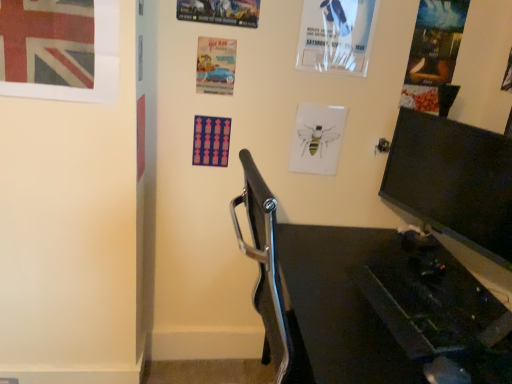
What do you see at coordinates (337, 35) in the screenshot?
I see `white paper poster at upper center, acting as the second poster page starting from the right` at bounding box center [337, 35].

Locate an element on the screen. union jack flag at upper left is located at coordinates (47, 42).

At what (x,y) coordinates should I click in order to perform the action: click on black plastic desk at lower right. Please return your answer as a coordinate pair (x, y). This screenshot has height=384, width=512. Looking at the image, I should click on (366, 301).

Locate an element on the screen. This screenshot has width=512, height=384. blue glossy car at center, marked as the second poster page in a left-to-right arrangement is located at coordinates (215, 65).

Where is `matte paper poster at upper right, which is counted as the first poster page, starting from the right`? The image size is (512, 384). matte paper poster at upper right, which is counted as the first poster page, starting from the right is located at coordinates (433, 52).

Locate an element on the screen. black glossy monitor at right is located at coordinates (453, 181).

Is the surface of black plastic desk at lower right in direct contact with blue glossy car at center, the fifth poster page in the right-to-left sequence?

They are not placed beside each other.

Consider the image. Is black plastic desk at lower right positioned with its back to blue glossy car at center, the fifth poster page in the right-to-left sequence?

That's not correct — black plastic desk at lower right is not looking away from blue glossy car at center, the fifth poster page in the right-to-left sequence.

Between point (339, 375) and point (212, 81), which one is positioned in front?

The point (339, 375) is more forward.

Considering the points (347, 259) and (193, 163), which point is behind, point (347, 259) or point (193, 163)?

The point (193, 163) is farther.

Considering the sizes of objects black plastic desk at lower right and matte plastic poster at center, the 6th poster page positioned from the right, in the image provided, who is shorter, black plastic desk at lower right or matte plastic poster at center, the 6th poster page positioned from the right,?

Standing shorter between the two is matte plastic poster at center, the 6th poster page positioned from the right.

Is black plastic desk at lower right in front of matte plastic poster at center, the 6th poster page positioned from the right?

Yes, it is.

Is black plastic desk at lower right situated inside matte plastic poster at center, the 6th poster page positioned from the right, or outside?

The correct answer is: outside.

Considering the sizes of objects white paper poster at upper center, acting as the second poster page starting from the right, and watercolor bee at center, the 3th poster page in the right-to-left sequence, in the image provided, who is thinner, white paper poster at upper center, acting as the second poster page starting from the right, or watercolor bee at center, the 3th poster page in the right-to-left sequence,?

watercolor bee at center, the 3th poster page in the right-to-left sequence, is thinner.

Does white paper poster at upper center, acting as the second poster page starting from the right, have a smaller size compared to watercolor bee at center, the 3th poster page in the right-to-left sequence?

No.

From a real-world perspective, starting from the white paper poster at upper center, acting as the second poster page starting from the right, which poster page is the 3rd one below it? Please provide its 2D coordinates.

[(317, 138)]

Is metallic silver car at upper center, the 3th poster page when ordered from left to right, positioned far away from blue glossy car at center, marked as the second poster page in a left-to-right arrangement?

No.

In the scene shown: Which is correct: metallic silver car at upper center, marked as the 4th poster page in a right-to-left arrangement, is inside blue glossy car at center, the fifth poster page in the right-to-left sequence, or outside of it?

metallic silver car at upper center, marked as the 4th poster page in a right-to-left arrangement, is not inside blue glossy car at center, the fifth poster page in the right-to-left sequence, it's outside.

Considering the positions of point (232, 18) and point (221, 80), is point (232, 18) closer or farther from the camera than point (221, 80)?

Point (232, 18) appears to be closer to the viewer than point (221, 80).

Looking at their sizes, would you say metallic silver car at upper center, marked as the 4th poster page in a right-to-left arrangement, is wider or thinner than blue glossy car at center, the fifth poster page in the right-to-left sequence?

Clearly, metallic silver car at upper center, marked as the 4th poster page in a right-to-left arrangement, has more width compared to blue glossy car at center, the fifth poster page in the right-to-left sequence.

Could you tell me if black glossy monitor at right is turned towards blue glossy car at center, marked as the second poster page in a left-to-right arrangement?

Yes, black glossy monitor at right faces towards blue glossy car at center, marked as the second poster page in a left-to-right arrangement.

Is the depth of black glossy monitor at right less than that of blue glossy car at center, the fifth poster page in the right-to-left sequence?

Yes.

Based on their sizes in the image, would you say black glossy monitor at right is bigger or smaller than blue glossy car at center, the fifth poster page in the right-to-left sequence?

Clearly, black glossy monitor at right is larger in size than blue glossy car at center, the fifth poster page in the right-to-left sequence.

Can you confirm if black glossy monitor at right is positioned to the right of blue glossy car at center, marked as the second poster page in a left-to-right arrangement?

Correct, you'll find black glossy monitor at right to the right of blue glossy car at center, marked as the second poster page in a left-to-right arrangement.

From the image's perspective, is union jack flag at upper left located above watercolor bee at center, the fourth poster page viewed from the left?

Yes.

From the picture: How many degrees apart are the facing directions of union jack flag at upper left and watercolor bee at center, the 3th poster page in the right-to-left sequence?

The facing directions of union jack flag at upper left and watercolor bee at center, the 3th poster page in the right-to-left sequence, are 0.676 degrees apart.

Which of these two, union jack flag at upper left or watercolor bee at center, the fourth poster page viewed from the left, is bigger?

With larger size is union jack flag at upper left.

Looking at this image, from a real-world perspective, which object stands above the other?

From a 3D spatial view, union jack flag at upper left is above.

From a real-world perspective, is metallic silver car at upper center, marked as the 4th poster page in a right-to-left arrangement, below black glossy monitor at right?

Actually, metallic silver car at upper center, marked as the 4th poster page in a right-to-left arrangement, is physically above black glossy monitor at right in the real world.

Which object is further away from the camera, metallic silver car at upper center, marked as the 4th poster page in a right-to-left arrangement, or black glossy monitor at right?

metallic silver car at upper center, marked as the 4th poster page in a right-to-left arrangement, is further from the camera.

How much distance is there between metallic silver car at upper center, marked as the 4th poster page in a right-to-left arrangement, and black glossy monitor at right?

The distance of metallic silver car at upper center, marked as the 4th poster page in a right-to-left arrangement, from black glossy monitor at right is 35.02 inches.

From the image's perspective, between metallic silver car at upper center, the 3th poster page when ordered from left to right, and black glossy monitor at right, who is located below?

black glossy monitor at right appears lower in the image.

This screenshot has height=384, width=512. There is a black plastic desk at lower right. What are the coordinates of `the 3rd poster page above it (from the image's perspective)` in the screenshot? It's located at (215, 65).

This screenshot has width=512, height=384. I want to click on furniture lying in front of the matte plastic poster at center, the 6th poster page positioned from the right, so click(366, 301).

Which object lies further to the anchor point blue glossy car at center, marked as the second poster page in a left-to-right arrangement, matte plastic poster at center, the 6th poster page positioned from the right, or union jack flag at upper left?

union jack flag at upper left is positioned further to the anchor blue glossy car at center, marked as the second poster page in a left-to-right arrangement.

Estimate the real-world distances between objects in this image. Which object is further from white paper poster at upper center, the 5th poster page from the left, matte plastic poster at center, the 6th poster page positioned from the right, or blue glossy car at center, the fifth poster page in the right-to-left sequence?

matte plastic poster at center, the 6th poster page positioned from the right, lies further to white paper poster at upper center, the 5th poster page from the left, than the other object.

Which object lies further to the anchor point union jack flag at upper left, blue glossy car at center, the fifth poster page in the right-to-left sequence, or white paper poster at upper center, acting as the second poster page starting from the right?

white paper poster at upper center, acting as the second poster page starting from the right.

Considering their positions, is matte plastic poster at center, the 6th poster page positioned from the right, positioned closer to matte paper poster at upper right, the 6th poster page viewed from the left, than blue glossy car at center, marked as the second poster page in a left-to-right arrangement?

blue glossy car at center, marked as the second poster page in a left-to-right arrangement, is positioned closer to the anchor matte paper poster at upper right, the 6th poster page viewed from the left.

Looking at this image, which object lies nearer to the anchor point white paper poster at upper center, acting as the second poster page starting from the right, blue glossy car at center, marked as the second poster page in a left-to-right arrangement, or matte paper poster at upper right, which is counted as the first poster page, starting from the right?

The object closer to white paper poster at upper center, acting as the second poster page starting from the right, is matte paper poster at upper right, which is counted as the first poster page, starting from the right.

When comparing their distances from union jack flag at upper left, does matte plastic poster at center, the first poster page when ordered from left to right, or white paper poster at upper center, the 5th poster page from the left, seem further?

white paper poster at upper center, the 5th poster page from the left, is further to union jack flag at upper left.

Looking at the image, which one is located closer to matte paper poster at upper right, which is counted as the first poster page, starting from the right, watercolor bee at center, the fourth poster page viewed from the left, or white paper poster at upper center, acting as the second poster page starting from the right?

Among the two, white paper poster at upper center, acting as the second poster page starting from the right, is located nearer to matte paper poster at upper right, which is counted as the first poster page, starting from the right.

From the image, which object appears to be nearer to black glossy monitor at right, matte paper poster at upper right, which is counted as the first poster page, starting from the right, or white paper poster at upper center, acting as the second poster page starting from the right?

matte paper poster at upper right, which is counted as the first poster page, starting from the right, is closer to black glossy monitor at right.

Locate an element on the screen. poster page between watercolor bee at center, the fourth poster page viewed from the left, and black plastic desk at lower right from top to bottom is located at coordinates (211, 141).

You are a GUI agent. You are given a task and a screenshot of the screen. Output one action in this format:
    pyautogui.click(x=<x>, y=<y>)
    Task: Click on the furniture between union jack flag at upper left and matte paper poster at upper right, the 6th poster page viewed from the left, from left to right
    
    Given the screenshot: What is the action you would take?
    pos(366,301)

Identify the location of poster that lies between white paper poster at upper center, the 5th poster page from the left, and black plastic desk at lower right from top to bottom. 47,42.

Image resolution: width=512 pixels, height=384 pixels. I want to click on computer monitor situated between union jack flag at upper left and matte paper poster at upper right, the 6th poster page viewed from the left, from left to right, so click(x=453, y=181).